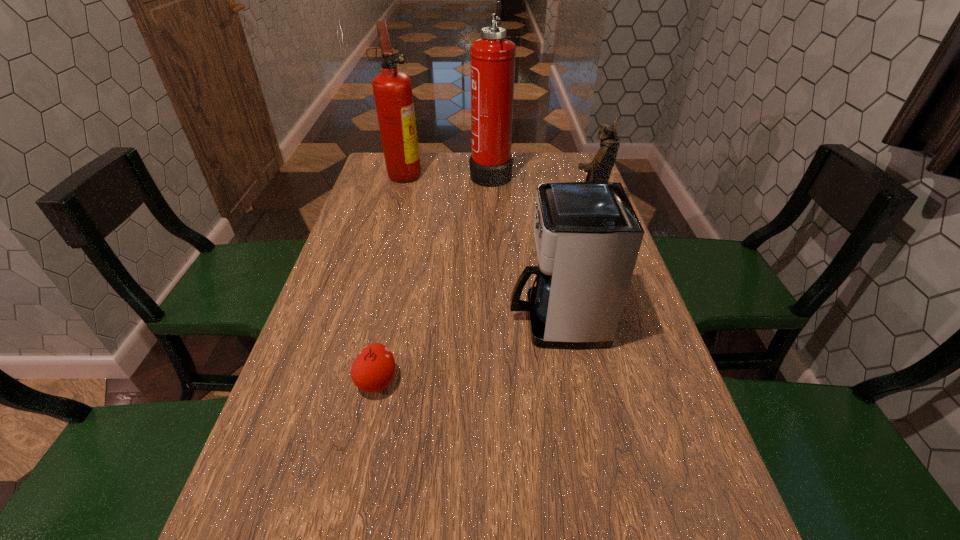
Where is `coffee maker located in the right edge section of the desktop`? This screenshot has height=540, width=960. coffee maker located in the right edge section of the desktop is located at coordinates (587, 235).

Identify the location of figurine located at the right edge. (599, 170).

Find the location of a particular element. Image resolution: width=960 pixels, height=540 pixels. object that is at the far left corner is located at coordinates (392, 89).

Locate an element on the screen. vacant space at the left edge of the desktop is located at coordinates (291, 455).

What are the coordinates of `free space between the right fire extinguisher and the left fire extinguisher` in the screenshot? It's located at (447, 173).

Locate an element on the screen. This screenshot has height=540, width=960. free area in between the second nearest object and the fourth shortest object is located at coordinates (480, 247).

Where is `free spot between the nearest object and the third farthest object`? The image size is (960, 540). free spot between the nearest object and the third farthest object is located at coordinates (483, 295).

This screenshot has height=540, width=960. Identify the location of free space that is in between the third nearest object and the fourth shortest object. (496, 191).

At what (x,y) coordinates should I click in order to perform the action: click on vacant space that is in between the third nearest object and the nearest object. Please return your answer as a coordinate pair (x, y). The width and height of the screenshot is (960, 540). Looking at the image, I should click on (483, 295).

The width and height of the screenshot is (960, 540). What are the coordinates of `vacant area that lies between the right fire extinguisher and the nearest object` in the screenshot? It's located at (434, 278).